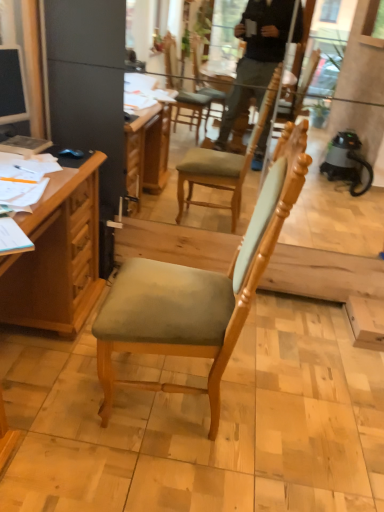
Question: Should I look upward or downward to see hardcover book at left?

Choices:
 (A) up
 (B) down

Answer: (A)

Question: Is blue matte computer mouse at upper left completely or partially inside hardcover book at left?

Choices:
 (A) no
 (B) yes

Answer: (A)

Question: Does hardcover book at left lie behind blue matte computer mouse at upper left?

Choices:
 (A) yes
 (B) no

Answer: (B)

Question: Is the depth of hardcover book at left less than that of blue matte computer mouse at upper left?

Choices:
 (A) yes
 (B) no

Answer: (A)

Question: Considering the relative positions of hardcover book at left and blue matte computer mouse at upper left in the image provided, is hardcover book at left to the right of blue matte computer mouse at upper left from the viewer's perspective?

Choices:
 (A) yes
 (B) no

Answer: (B)

Question: Considering the relative sizes of hardcover book at left and blue matte computer mouse at upper left in the image provided, is hardcover book at left wider than blue matte computer mouse at upper left?

Choices:
 (A) no
 (B) yes

Answer: (B)

Question: Is hardcover book at left to the left of blue matte computer mouse at upper left from the viewer's perspective?

Choices:
 (A) no
 (B) yes

Answer: (B)

Question: From a real-world perspective, is matte black monitor at left physically above light brown wood chair at center?

Choices:
 (A) yes
 (B) no

Answer: (A)

Question: Is the position of matte black monitor at left more distant than that of light brown wood chair at center?

Choices:
 (A) yes
 (B) no

Answer: (A)

Question: Considering the relative positions of matte black monitor at left and light brown wood chair at center in the image provided, is matte black monitor at left to the right of light brown wood chair at center from the viewer's perspective?

Choices:
 (A) no
 (B) yes

Answer: (A)

Question: Is matte black monitor at left wider than light brown wood chair at center?

Choices:
 (A) no
 (B) yes

Answer: (A)

Question: Does matte black monitor at left have a larger size compared to light brown wood chair at center?

Choices:
 (A) no
 (B) yes

Answer: (A)

Question: Is matte black monitor at left beside light brown wood chair at center?

Choices:
 (A) no
 (B) yes

Answer: (A)

Question: Is blue matte computer mouse at upper left not within light brown wood chair at center?

Choices:
 (A) no
 (B) yes

Answer: (B)